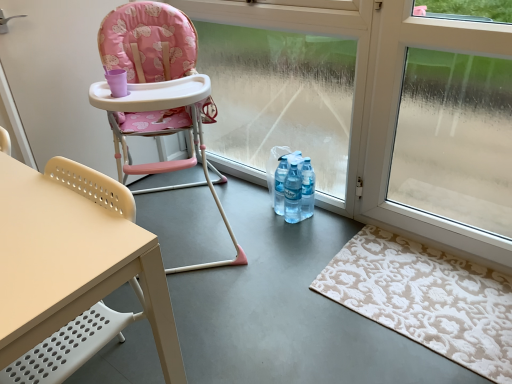
This screenshot has width=512, height=384. What are the coordinates of `free spot in front of pink fabric highchair at left, the 1th chair when ordered from back to front` in the screenshot? It's located at (232, 315).